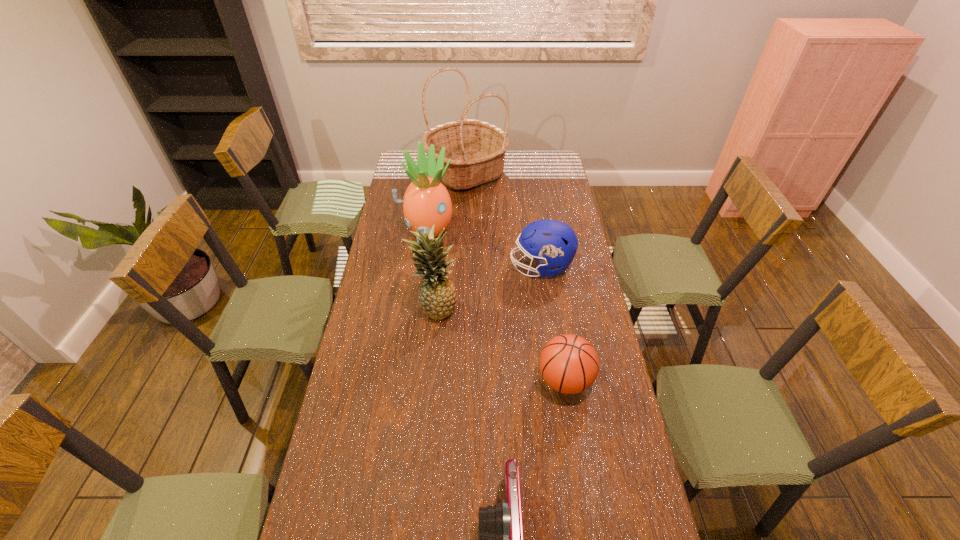
Locate an element on the screen. The image size is (960, 540). object located in the far left corner section of the desktop is located at coordinates (476, 148).

Locate an element on the screen. This screenshot has width=960, height=540. free space at the left edge of the desktop is located at coordinates (380, 407).

Identify the location of vacant region at the right edge of the desktop. (571, 292).

Find the location of a particular element. This screenshot has height=540, width=960. free spot between the third nearest object and the tallest object is located at coordinates (451, 239).

Identify the location of vacant area that lies between the nearer pineapple and the tallest object. (451, 239).

The height and width of the screenshot is (540, 960). I want to click on empty location between the nearer pineapple and the fifth tallest object, so click(x=500, y=343).

Where is `vacant area that lies between the football helmet and the tallest object`? The height and width of the screenshot is (540, 960). vacant area that lies between the football helmet and the tallest object is located at coordinates (504, 219).

What are the coordinates of `unoccupied area between the second nearest object and the football helmet` in the screenshot? It's located at (553, 323).

Locate which object ranks third in proximity to the farther pineapple. Please provide its 2D coordinates. Your answer should be formatted as a tuple, i.e. [(x, y)], where the tuple contains the x and y coordinates of a point satisfying the conditions above.

[(437, 295)]

Point out which object is positioned as the third nearest to the basket. Please provide its 2D coordinates. Your answer should be formatted as a tuple, i.e. [(x, y)], where the tuple contains the x and y coordinates of a point satisfying the conditions above.

[(437, 295)]